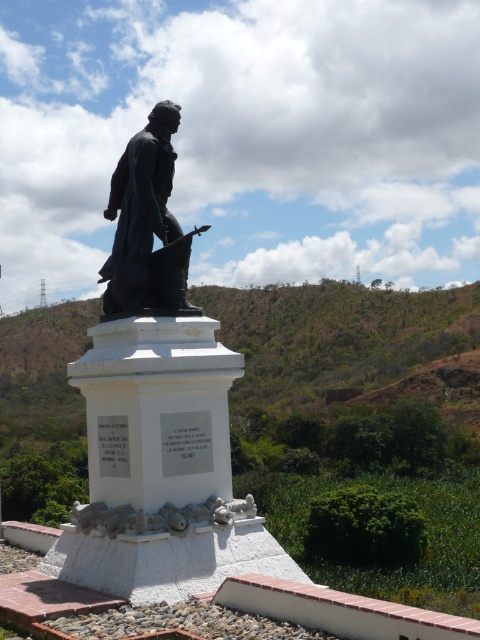
You are standing at the base of the black polished statue at center and want to walk to the nearest tree. The distance between you and the tree is 29.60 feet. If your walking speed is 3 feet per second, how long will it take you to reach the tree?

The distance between the black polished statue at center and the tree is 29.60 feet. At a speed of 3 feet per second, it will take approximately 9.87 seconds to reach the tree.

You are a landscape architect designing a new garden path that needs to pass between the green leafy hillside at center and the bronze statue at center. Given that the path must be at least 2 meters wide to accommodate visitors, can you determine if there is enough space between them based on their widths?

The green leafy hillside at center is wider than the bronze statue at center. However, the exact widths are not provided, so it is impossible to determine if the 2 meter path requirement can be met without additional measurements.

You are a landscape architect designing a new garden around the black polished statue at center and the green leafy hillside at center. Considering their heights, which object should be placed closer to visitors to ensure both are visible without obstruction?

The black polished statue at center has a lesser height compared to the green leafy hillside at center, so the statue should be placed closer to visitors to ensure it is visible over the taller hillside.